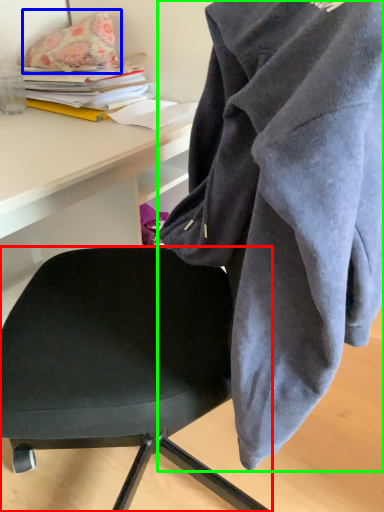
Question: Which object is the closest to the chair (highlighted by a red box)? Choose among these: pillow (highlighted by a blue box) or cloak (highlighted by a green box).

Choices:
 (A) pillow
 (B) cloak

Answer: (B)